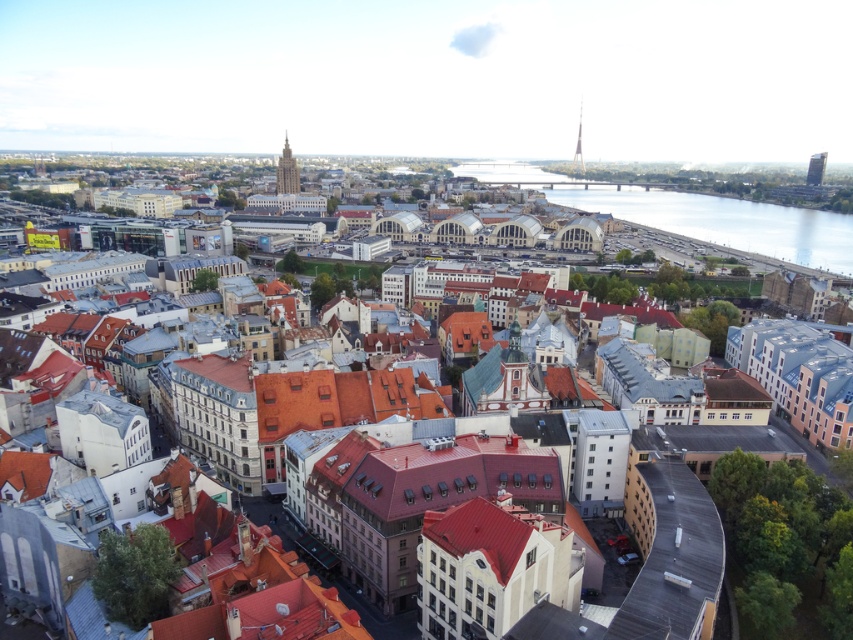
Based on the photo, is reflective glass waterway at center shorter than smooth glass tower at upper right?

In fact, reflective glass waterway at center may be taller than smooth glass tower at upper right.

How much distance is there between reflective glass waterway at center and smooth glass tower at upper right?

reflective glass waterway at center and smooth glass tower at upper right are 129.67 meters apart.

You are a GUI agent. You are given a task and a screenshot of the screen. Output one action in this format:
    pyautogui.click(x=<x>, y=<y>)
    Task: Click on the reflective glass waterway at center
    
    Given the screenshot: What is the action you would take?
    pyautogui.click(x=724, y=221)

Can you confirm if matte gray tower at center is thinner than smooth glass tower at upper right?

No, matte gray tower at center is not thinner than smooth glass tower at upper right.

Between point (294, 163) and point (573, 157), which one is positioned in front?

Point (294, 163) is in front.

Where is `matte gray tower at center`? matte gray tower at center is located at coordinates (287, 172).

Consider the image. Which of these two, matte gray tower at center or smooth glass skyscraper at right, stands taller?

matte gray tower at center is taller.

Can you confirm if matte gray tower at center is thinner than smooth glass skyscraper at right?

No.

Between point (289, 184) and point (816, 176), which one is positioned in front?

Point (289, 184) is in front.

Where is `matte gray tower at center`? The height and width of the screenshot is (640, 853). matte gray tower at center is located at coordinates (287, 172).